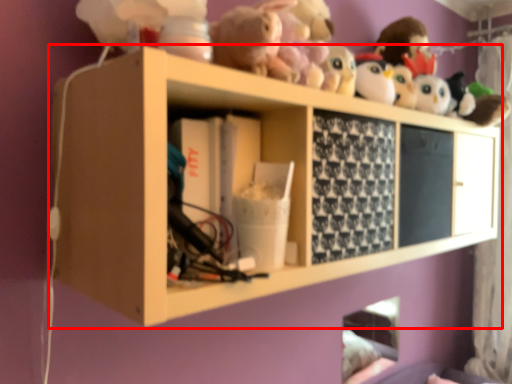
Question: From the image's perspective, what is the correct spatial positioning of shelf (annotated by the red box) in reference to curtain?

Choices:
 (A) below
 (B) above

Answer: (B)